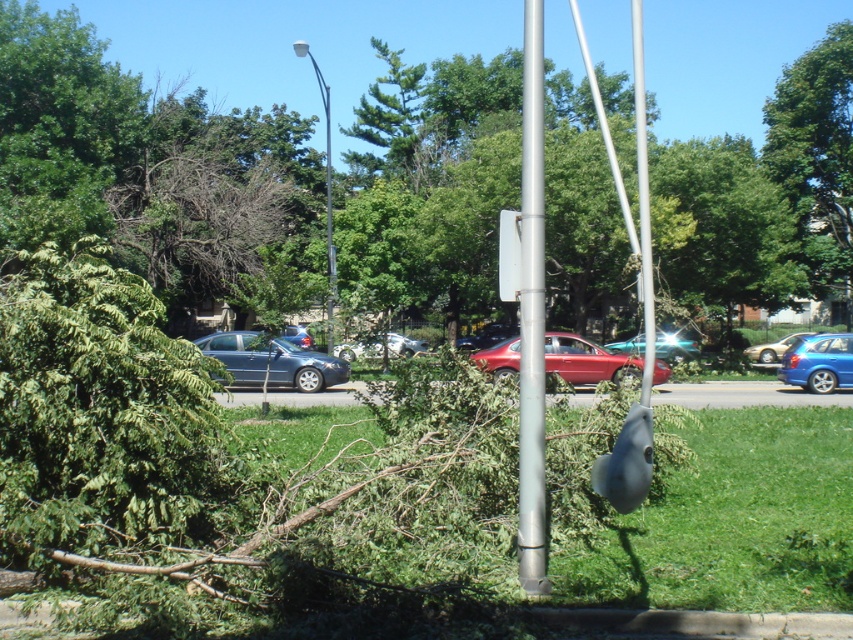
This screenshot has height=640, width=853. Describe the element at coordinates (380, 348) in the screenshot. I see `silver metallic sedan at center` at that location.

Does point (393, 340) come in front of point (746, 355)?

No, it is behind (746, 355).

Between point (421, 348) and point (746, 355), which one is positioned behind?

The point (421, 348) is more distant.

Identify the location of silver metallic sedan at center. This screenshot has width=853, height=640. (380, 348).

Is green leafy tree at left to the right of silver metallic flag pole at center from the viewer's perspective?

Incorrect, green leafy tree at left is not on the right side of silver metallic flag pole at center.

Which is more to the right, green leafy tree at left or silver metallic flag pole at center?

silver metallic flag pole at center is more to the right.

Is point (122, 541) positioned before point (648, 305)?

That is False.

What are the coordinates of `green leafy tree at left` in the screenshot? It's located at (103, 417).

Can you confirm if silver metallic sedan at center is shorter than metallic blue car at center?

Yes.

Which of these two, silver metallic sedan at center or metallic blue car at center, stands shorter?

Standing shorter between the two is silver metallic sedan at center.

Is point (358, 346) closer to viewer compared to point (659, 342)?

Yes, point (358, 346) is closer to viewer.

You are a GUI agent. You are given a task and a screenshot of the screen. Output one action in this format:
    pyautogui.click(x=<x>, y=<y>)
    Task: Click on the silver metallic sedan at center
    The width and height of the screenshot is (853, 640).
    Given the screenshot: What is the action you would take?
    pyautogui.click(x=380, y=348)